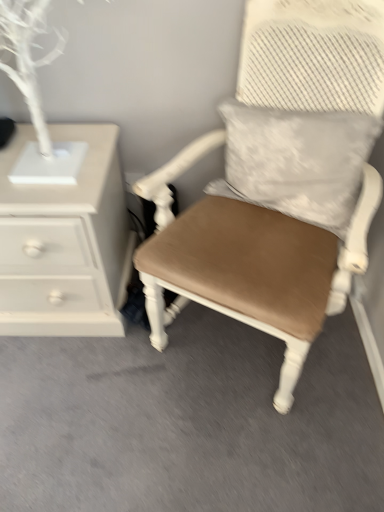
Question: Considering the relative positions of matte brown cushioned chair at center and white painted wood chest of drawers at left in the image provided, is matte brown cushioned chair at center to the right of white painted wood chest of drawers at left from the viewer's perspective?

Choices:
 (A) no
 (B) yes

Answer: (B)

Question: Can you confirm if matte brown cushioned chair at center is wider than white painted wood chest of drawers at left?

Choices:
 (A) no
 (B) yes

Answer: (B)

Question: From the image's perspective, is matte brown cushioned chair at center under white painted wood chest of drawers at left?

Choices:
 (A) yes
 (B) no

Answer: (B)

Question: Are matte brown cushioned chair at center and white painted wood chest of drawers at left beside each other?

Choices:
 (A) yes
 (B) no

Answer: (B)

Question: Does matte brown cushioned chair at center turn towards white painted wood chest of drawers at left?

Choices:
 (A) no
 (B) yes

Answer: (A)

Question: Considering the positions of white textured pillow at upper right and matte brown cushioned chair at center in the image, is white textured pillow at upper right bigger or smaller than matte brown cushioned chair at center?

Choices:
 (A) big
 (B) small

Answer: (B)

Question: From the image's perspective, is white textured pillow at upper right above or below matte brown cushioned chair at center?

Choices:
 (A) above
 (B) below

Answer: (A)

Question: In terms of height, does white textured pillow at upper right look taller or shorter compared to matte brown cushioned chair at center?

Choices:
 (A) short
 (B) tall

Answer: (A)

Question: From a real-world perspective, is white textured pillow at upper right positioned above or below matte brown cushioned chair at center?

Choices:
 (A) below
 (B) above

Answer: (B)

Question: Is white painted wood chest of drawers at left in front of or behind matte brown cushioned chair at center in the image?

Choices:
 (A) front
 (B) behind

Answer: (B)

Question: From the image's perspective, is white painted wood chest of drawers at left positioned above or below matte brown cushioned chair at center?

Choices:
 (A) above
 (B) below

Answer: (B)

Question: From a real-world perspective, is white painted wood chest of drawers at left above or below matte brown cushioned chair at center?

Choices:
 (A) below
 (B) above

Answer: (A)

Question: Considering the positions of white painted wood chest of drawers at left and matte brown cushioned chair at center in the image, is white painted wood chest of drawers at left wider or thinner than matte brown cushioned chair at center?

Choices:
 (A) thin
 (B) wide

Answer: (A)

Question: From the image's perspective, is matte brown cushioned chair at center positioned above or below white painted wood chest of drawers at left?

Choices:
 (A) below
 (B) above

Answer: (B)

Question: From a real-world perspective, relative to white painted wood chest of drawers at left, is matte brown cushioned chair at center vertically above or below?

Choices:
 (A) below
 (B) above

Answer: (B)